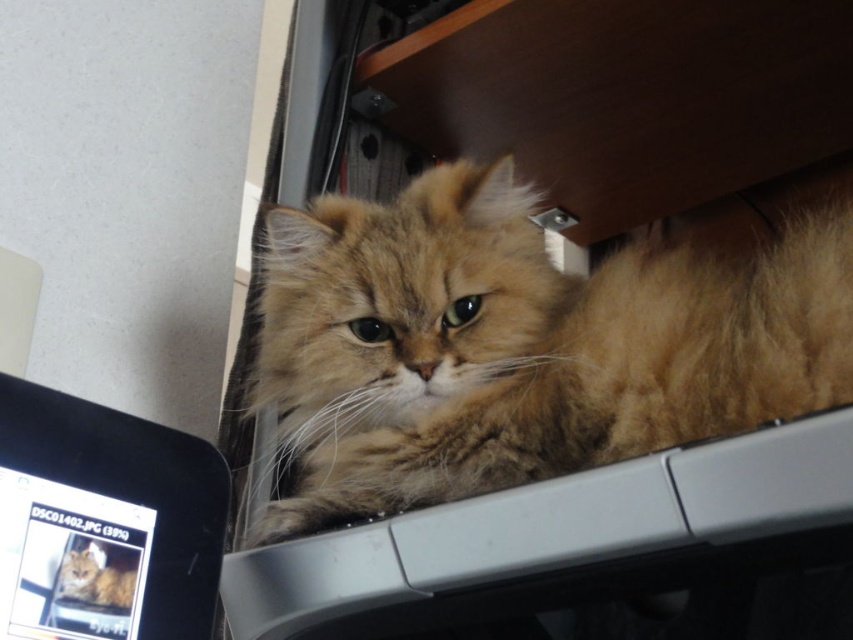
Is fuzzy golden cat at center thinner than fuzzy golden cat at upper right?

No, fuzzy golden cat at center is not thinner than fuzzy golden cat at upper right.

Is fuzzy golden cat at center to the left of fuzzy golden cat at upper right from the viewer's perspective?

No, fuzzy golden cat at center is not to the left of fuzzy golden cat at upper right.

Where is `fuzzy golden cat at center`? fuzzy golden cat at center is located at coordinates (521, 346).

You are a GUI agent. You are given a task and a screenshot of the screen. Output one action in this format:
    pyautogui.click(x=<x>, y=<y>)
    Task: Click on the fuzzy golden cat at center
    Image resolution: width=853 pixels, height=640 pixels.
    Given the screenshot: What is the action you would take?
    pyautogui.click(x=521, y=346)

Is fuzzy golden cat at center closer to camera compared to matte black monitor at lower left?

No.

Who is more forward, (482, 428) or (125, 605)?

Point (125, 605)

Describe the element at coordinates (521, 346) in the screenshot. This screenshot has height=640, width=853. I see `fuzzy golden cat at center` at that location.

Locate an element on the screen. The image size is (853, 640). fuzzy golden cat at center is located at coordinates (521, 346).

Does matte black monitor at lower left have a smaller size compared to fuzzy golden cat at upper right?

Incorrect, matte black monitor at lower left is not smaller in size than fuzzy golden cat at upper right.

How far apart are matte black monitor at lower left and fuzzy golden cat at upper right?

They are 2.50 inches apart.

At what (x,y) coordinates should I click in order to perform the action: click on matte black monitor at lower left. Please return your answer as a coordinate pair (x, y). Looking at the image, I should click on (113, 513).